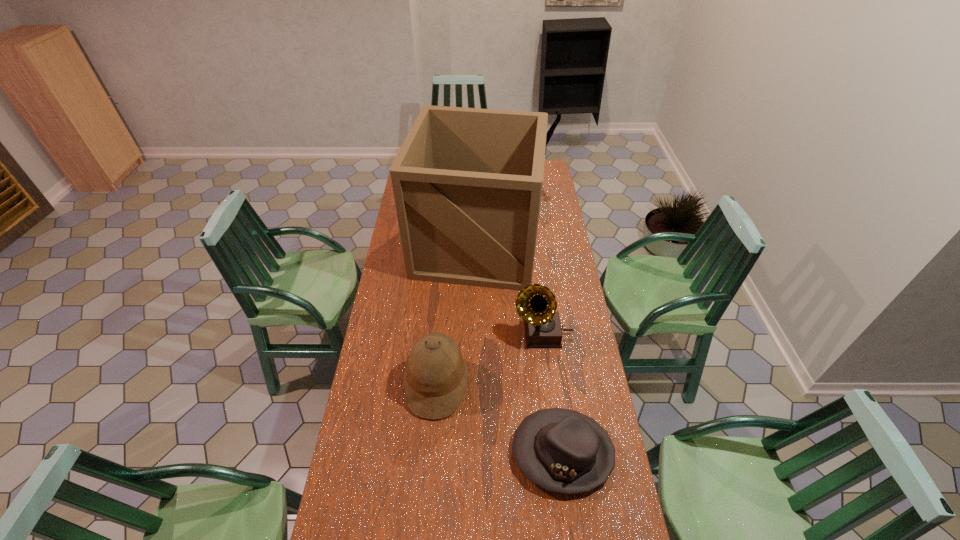
Where is `box that is positioned at the left edge`? The width and height of the screenshot is (960, 540). box that is positioned at the left edge is located at coordinates (467, 182).

Where is `hat that is at the left edge`? This screenshot has height=540, width=960. hat that is at the left edge is located at coordinates (435, 377).

Where is `box present at the right edge`? The width and height of the screenshot is (960, 540). box present at the right edge is located at coordinates (467, 182).

Locate an element on the screen. cat that is at the right edge is located at coordinates (550, 132).

At what (x,y) coordinates should I click in order to perform the action: click on phonograph record positioned at the right edge. Please return your answer as a coordinate pair (x, y). Looking at the image, I should click on point(536,304).

This screenshot has height=540, width=960. I want to click on hat present at the right edge, so click(564, 451).

I want to click on object that is positioned at the far right corner, so click(x=550, y=132).

The height and width of the screenshot is (540, 960). In the image, there is a desktop. Identify the location of vacant space at the left edge. (394, 326).

Where is `vacant region at the right edge of the desktop`? This screenshot has height=540, width=960. vacant region at the right edge of the desktop is located at coordinates (563, 346).

Locate an element on the screen. The height and width of the screenshot is (540, 960). vacant space that's between the taller hat and the shortest object is located at coordinates (499, 418).